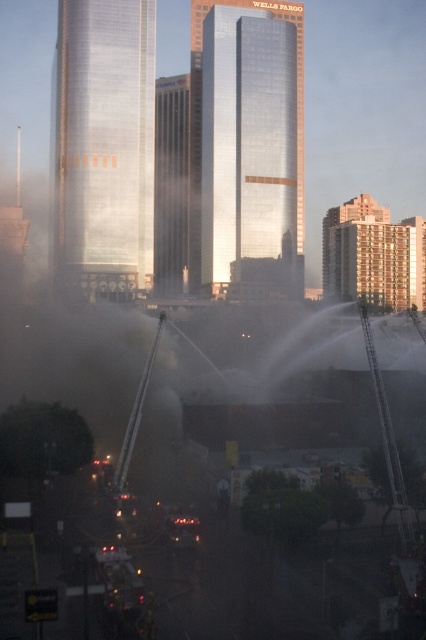
Question: Which point appears closest to the camera in this image?

Choices:
 (A) (138, 198)
 (B) (158, 108)

Answer: (A)

Question: Does shiny metallic skyscraper at center appear on the right side of reflective glass skyscraper at center?

Choices:
 (A) yes
 (B) no

Answer: (B)

Question: Estimate the real-world distances between objects in this image. Which object is closer to the glossy glass skyscraper at center?

Choices:
 (A) shiny metallic skyscraper at center
 (B) reflective glass skyscraper at center

Answer: (B)

Question: Among these objects, which one is farthest from the camera?

Choices:
 (A) reflective glass skyscraper at center
 (B) glossy glass skyscraper at center
 (C) shiny metallic skyscraper at center

Answer: (B)

Question: Does reflective glass skyscraper at center come in front of glossy glass skyscraper at center?

Choices:
 (A) yes
 (B) no

Answer: (A)

Question: Does reflective glass skyscraper at center have a greater width compared to glossy glass skyscraper at center?

Choices:
 (A) yes
 (B) no

Answer: (B)